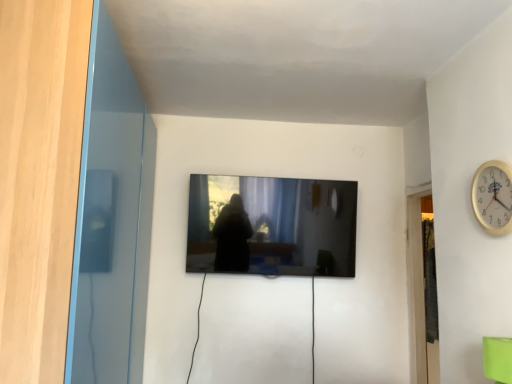
Question: Is transparent glass door at left taller or shorter than matte black tv at center?

Choices:
 (A) short
 (B) tall

Answer: (B)

Question: Visually, is transparent glass door at left positioned to the left or to the right of matte black tv at center?

Choices:
 (A) left
 (B) right

Answer: (A)

Question: Which of these objects is positioned closest to the green matte cup at lower right?

Choices:
 (A) matte black tv at center
 (B) gold metallic wall clock at upper right
 (C) transparent glass door at left

Answer: (B)

Question: Based on their relative distances, which object is farther from the gold metallic wall clock at upper right?

Choices:
 (A) matte black tv at center
 (B) green matte cup at lower right
 (C) transparent glass door at left

Answer: (C)